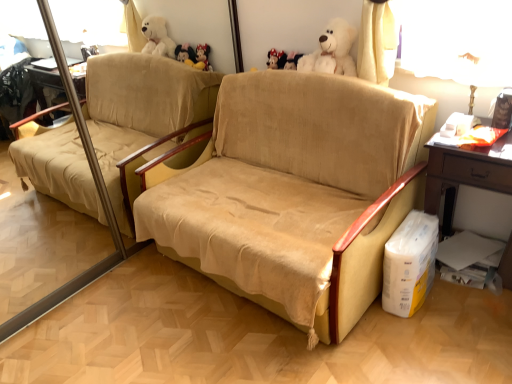
Locate an element on the screen. The height and width of the screenshot is (384, 512). free space in front of white cardboard box at lower right is located at coordinates (430, 331).